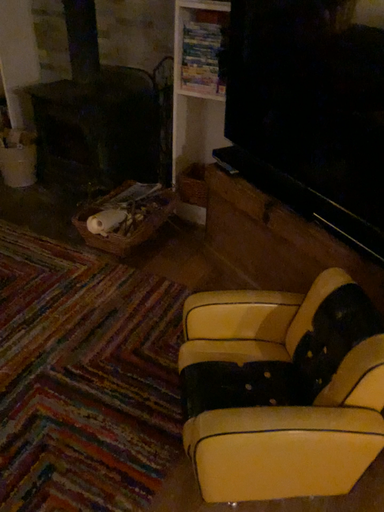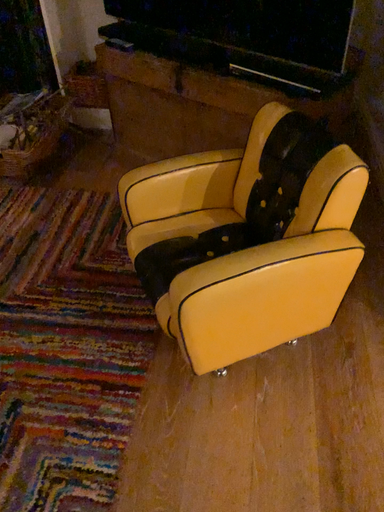
Question: How did the camera likely rotate when shooting the video?

Choices:
 (A) rotated upward
 (B) rotated downward

Answer: (B)